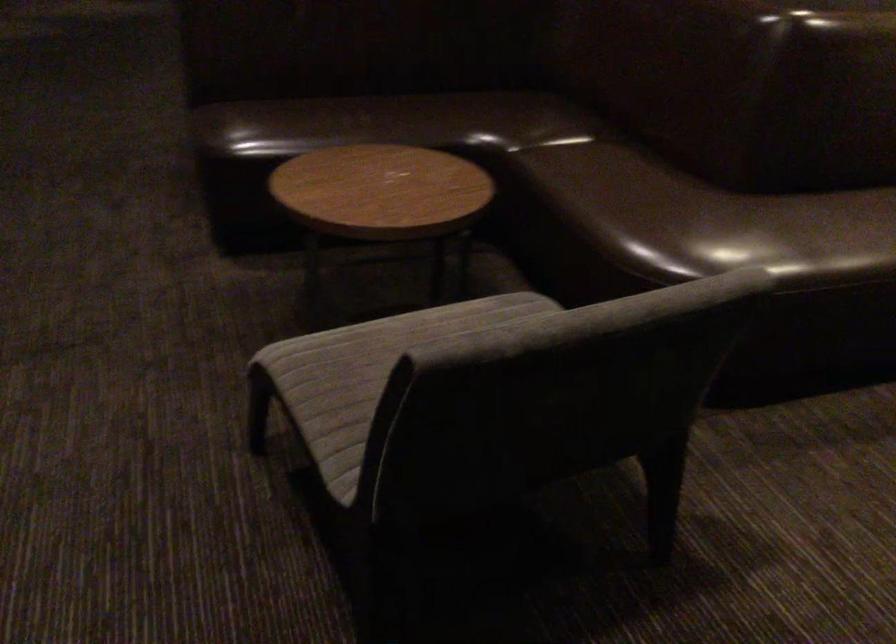
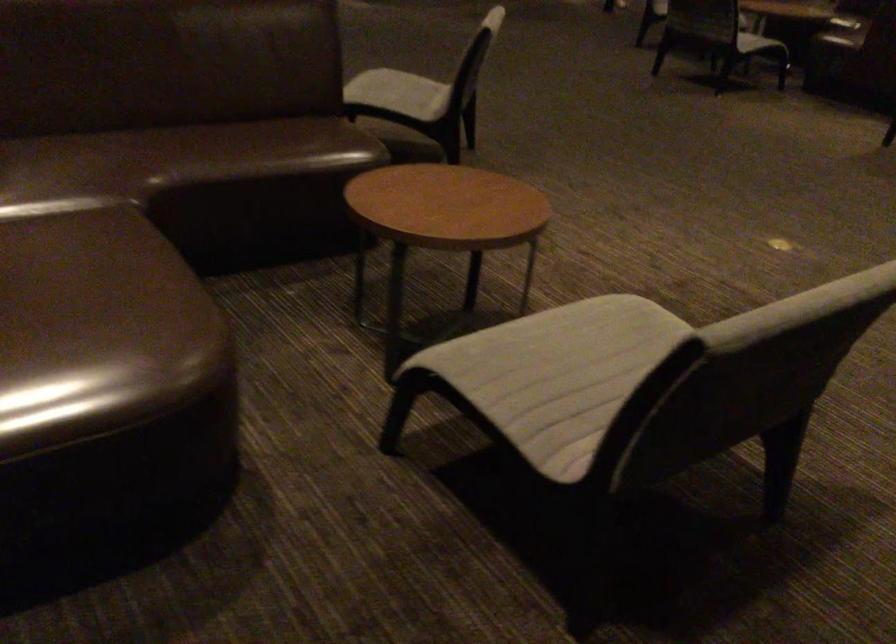
Question: In a continuous first-person perspective shot, in which direction is the camera moving?

Choices:
 (A) Left
 (B) Right
 (C) Forward
 (D) Backward

Answer: (B)